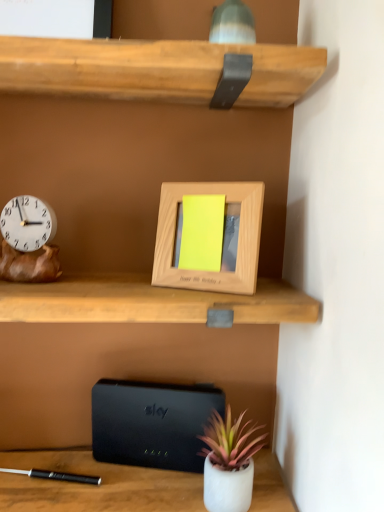
Question: Would you consider matte white pot at lower center to be distant from black matte/black plastic at lower center?

Choices:
 (A) yes
 (B) no

Answer: (B)

Question: From a real-world perspective, is matte white pot at lower center below black matte/black plastic at lower center?

Choices:
 (A) yes
 (B) no

Answer: (A)

Question: Is matte white pot at lower center closer to the viewer compared to black matte/black plastic at lower center?

Choices:
 (A) yes
 (B) no

Answer: (A)

Question: Is matte white pot at lower center further to the viewer compared to black matte/black plastic at lower center?

Choices:
 (A) no
 (B) yes

Answer: (A)

Question: Could you tell me if matte white pot at lower center is facing black matte/black plastic at lower center?

Choices:
 (A) yes
 (B) no

Answer: (B)

Question: Is wooden clock at left bigger or smaller than black matte/black plastic at lower center?

Choices:
 (A) small
 (B) big

Answer: (A)

Question: From a real-world perspective, relative to black matte/black plastic at lower center, is wooden clock at left vertically above or below?

Choices:
 (A) above
 (B) below

Answer: (A)

Question: From the image's perspective, is wooden clock at left located above or below black matte/black plastic at lower center?

Choices:
 (A) above
 (B) below

Answer: (A)

Question: Is wooden clock at left in front of or behind black matte/black plastic at lower center in the image?

Choices:
 (A) front
 (B) behind

Answer: (A)

Question: Considering their positions, is wooden photo frame at center located in front of or behind black matte/black plastic at lower center?

Choices:
 (A) front
 (B) behind

Answer: (A)

Question: From the image's perspective, is wooden photo frame at center above or below black matte/black plastic at lower center?

Choices:
 (A) above
 (B) below

Answer: (A)

Question: Based on their positions, is wooden photo frame at center located to the left or right of black matte/black plastic at lower center?

Choices:
 (A) left
 (B) right

Answer: (B)

Question: Considering the positions of wooden photo frame at center and black matte/black plastic at lower center in the image, is wooden photo frame at center bigger or smaller than black matte/black plastic at lower center?

Choices:
 (A) small
 (B) big

Answer: (B)

Question: Considering their positions, is matte white pot at lower center located in front of or behind wooden clock at left?

Choices:
 (A) front
 (B) behind

Answer: (A)

Question: From a real-world perspective, relative to wooden clock at left, is matte white pot at lower center vertically above or below?

Choices:
 (A) below
 (B) above

Answer: (A)